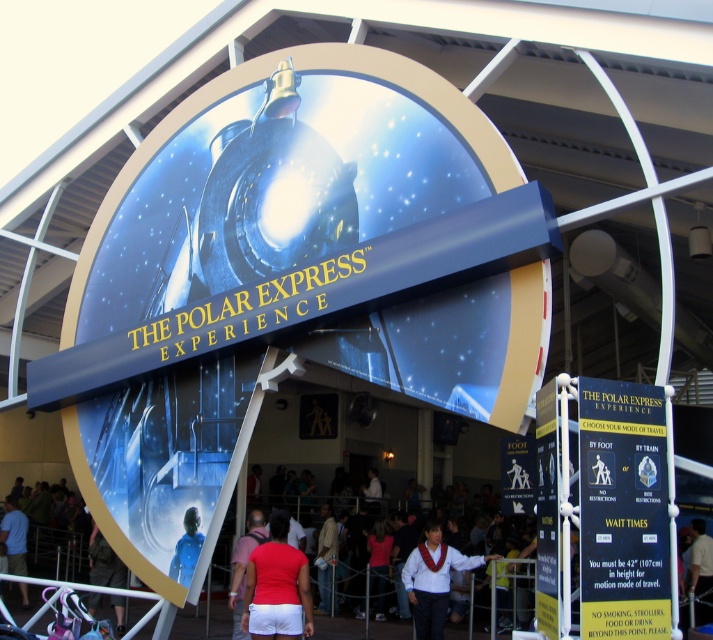
Question: Among these objects, which one is farthest from the camera?

Choices:
 (A) matte red shirt at center
 (B) black plastic sign at center
 (C) dark blue shirt at lower left
 (D) white satin vest at center

Answer: (C)

Question: Which object is the closest to the blue fabric shirt at center?

Choices:
 (A) matte red shirt at center
 (B) black plastic sign at center

Answer: (A)

Question: Does white satin vest at center appear over dark blue shirt at lower left?

Choices:
 (A) no
 (B) yes

Answer: (B)

Question: Which object is farther from the camera taking this photo?

Choices:
 (A) dark blue shirt at lower left
 (B) white fabric shirt at center

Answer: (A)

Question: Can you confirm if white satin vest at center is positioned above dark blue shirt at lower left?

Choices:
 (A) yes
 (B) no

Answer: (A)

Question: Can you confirm if white satin vest at center is positioned below white fabric shirt at center?

Choices:
 (A) no
 (B) yes

Answer: (A)